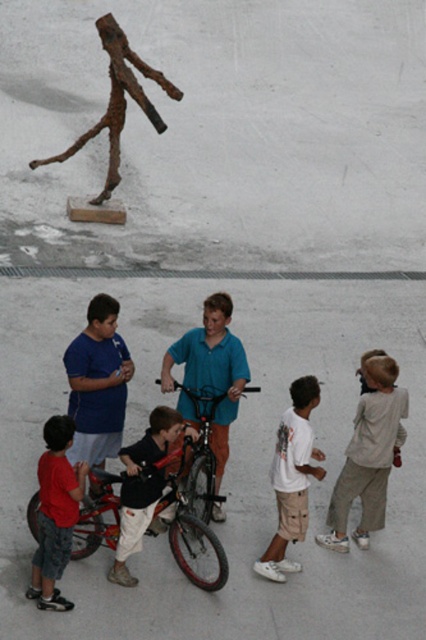
Question: Where is white cotton shirt at center located in relation to shiny metallic bicycle at center in the image?

Choices:
 (A) left
 (B) right

Answer: (B)

Question: Does red cotton shirt at lower left appear on the left side of rusty metal stick figure at upper left?

Choices:
 (A) no
 (B) yes

Answer: (A)

Question: Which point appears closest to the camera in this image?

Choices:
 (A) (115, 518)
 (B) (66, 468)
 (C) (215, 406)
 (D) (281, 580)

Answer: (B)

Question: Is rusty metal stick figure at upper left in front of shiny metallic bicycle at center?

Choices:
 (A) yes
 (B) no

Answer: (B)

Question: Which object is positioned closest to the rusty metal stick figure at upper left?

Choices:
 (A) light beige cotton pants at lower right
 (B) dark blue shirt at center
 (C) red matte bicycle at center
 (D) shiny metallic bicycle at center

Answer: (D)

Question: Which is farther from the light beige cotton pants at lower right?

Choices:
 (A) rusty metal stick figure at upper left
 (B) red cotton shirt at lower left
 (C) white cotton shirt at center

Answer: (A)